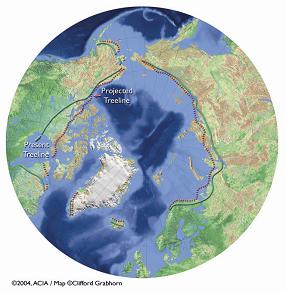
Image resolution: width=286 pixels, height=293 pixels. What are the coordinates of `globe` in the screenshot? It's located at (154, 138).